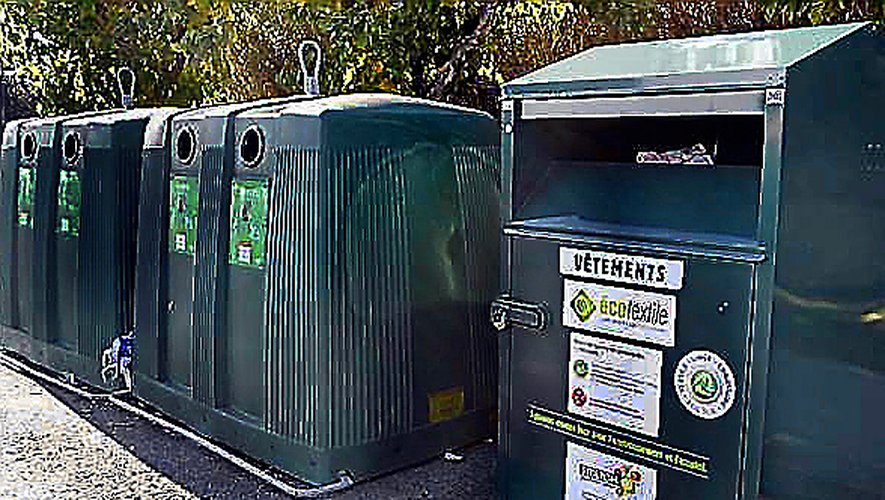
You are a GUI agent. You are given a task and a screenshot of the screen. Output one action in this format:
    pyautogui.click(x=<x>, y=<y>)
    Task: Click on the green label on recycling bin
    
    Given the screenshot: What is the action you would take?
    pyautogui.click(x=244, y=227), pyautogui.click(x=189, y=211), pyautogui.click(x=64, y=208), pyautogui.click(x=25, y=204)